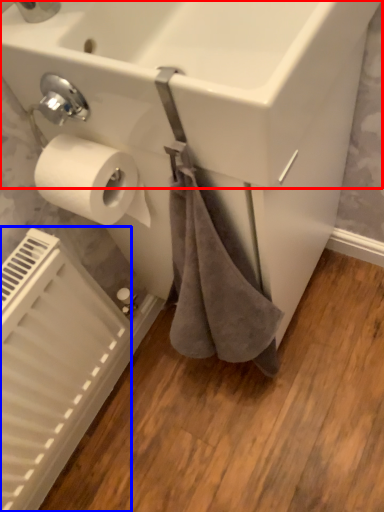
Question: Among these objects, which one is farthest to the camera, sink (highlighted by a red box) or radiator (highlighted by a blue box)?

Choices:
 (A) sink
 (B) radiator

Answer: (B)